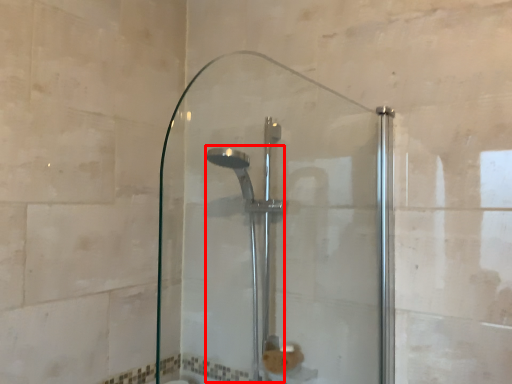
Question: From the image's perspective, where is shower (annotated by the red box) located in relation to screen door in the image?

Choices:
 (A) below
 (B) above

Answer: (A)